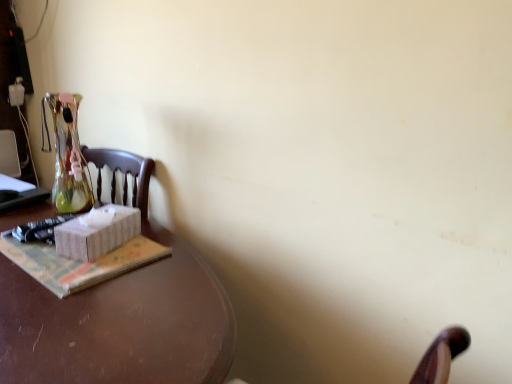
Question: Can you confirm if white paper at left is thinner than white wicker box at left?

Choices:
 (A) yes
 (B) no

Answer: (B)

Question: Can you confirm if white paper at left is smaller than white wicker box at left?

Choices:
 (A) no
 (B) yes

Answer: (A)

Question: From the image's perspective, is white paper at left located beneath white wicker box at left?

Choices:
 (A) no
 (B) yes

Answer: (B)

Question: Is white paper at left wider than white wicker box at left?

Choices:
 (A) yes
 (B) no

Answer: (A)

Question: Does white paper at left lie behind white wicker box at left?

Choices:
 (A) no
 (B) yes

Answer: (A)

Question: From a real-world perspective, does white paper at left sit lower than white wicker box at left?

Choices:
 (A) no
 (B) yes

Answer: (B)

Question: Is white wicker box at left positioned with its back to white paper at left?

Choices:
 (A) no
 (B) yes

Answer: (A)

Question: Does white wicker box at left have a larger size compared to white paper at left?

Choices:
 (A) no
 (B) yes

Answer: (A)

Question: Can you confirm if white wicker box at left is thinner than white paper at left?

Choices:
 (A) yes
 (B) no

Answer: (A)

Question: Is white wicker box at left to the right of white paper at left from the viewer's perspective?

Choices:
 (A) no
 (B) yes

Answer: (B)

Question: Is white wicker box at left further to camera compared to white paper at left?

Choices:
 (A) yes
 (B) no

Answer: (A)

Question: From the image's perspective, is white wicker box at left below white paper at left?

Choices:
 (A) no
 (B) yes

Answer: (A)

Question: Considering the relative positions of brown polished wood desk at left and white paper at left in the image provided, is brown polished wood desk at left to the right of white paper at left from the viewer's perspective?

Choices:
 (A) no
 (B) yes

Answer: (A)